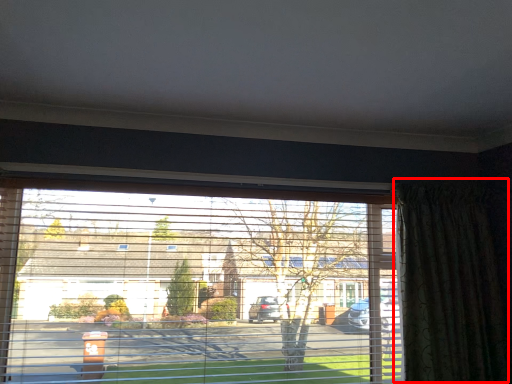
Question: From the image's perspective, where is curtain (annotated by the red box) located relative to window?

Choices:
 (A) below
 (B) above

Answer: (B)